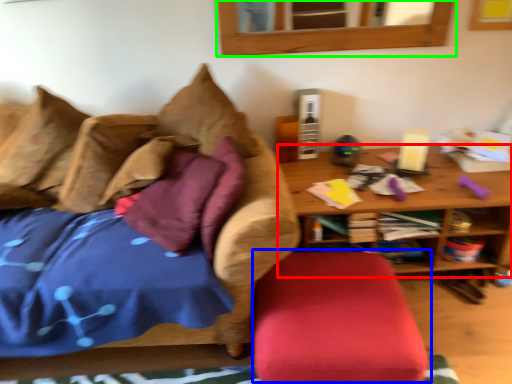
Question: Based on their relative distances, which object is nearer to table (highlighted by a red box)? Choose from swivel chair (highlighted by a blue box) and mirror (highlighted by a green box).

Choices:
 (A) swivel chair
 (B) mirror

Answer: (A)